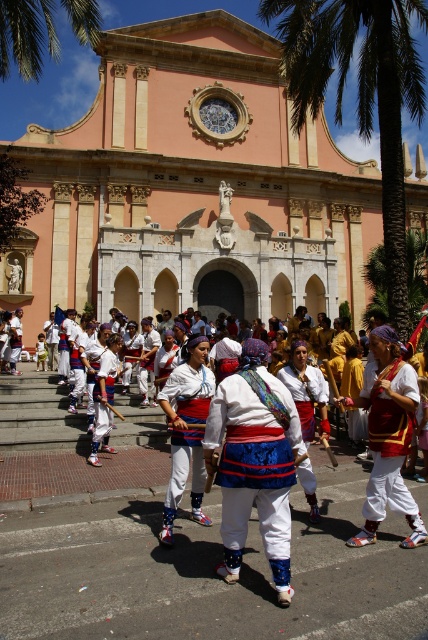
Question: Can you confirm if white cotton skirt at center is wider than green leafy palm tree at upper left?

Choices:
 (A) yes
 (B) no

Answer: (B)

Question: Considering the real-world distances, which object is farthest from the green leafy palm tree at upper left?

Choices:
 (A) pink stone church at center
 (B) white cotton dress at center
 (C) green leafy palm tree at right

Answer: (B)

Question: Which of the following is the closest to the observer?

Choices:
 (A) white cotton skirt at center
 (B) white cotton costumes at center
 (C) pink stone church at center

Answer: (B)

Question: Can you confirm if white cotton skirt at center is positioned to the left of white cotton dress at center?

Choices:
 (A) no
 (B) yes

Answer: (A)

Question: Where is white cotton costumes at center located in relation to green leafy palm tree at upper left in the image?

Choices:
 (A) left
 (B) right

Answer: (B)

Question: Which of the following is the closest to the observer?

Choices:
 (A) click(318, 500)
 (B) click(404, 369)

Answer: (B)